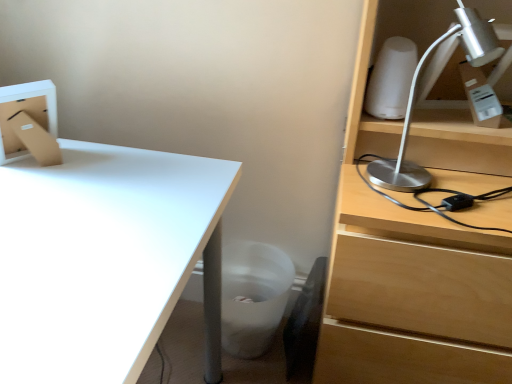
Question: Choose the correct answer: Is white glossy desk at lower left inside white matte trash bin/can at lower center or outside it?

Choices:
 (A) outside
 (B) inside

Answer: (A)

Question: Looking at their shapes, would you say white glossy desk at lower left is wider or thinner than white matte trash bin/can at lower center?

Choices:
 (A) wide
 (B) thin

Answer: (A)

Question: Based on their relative distances, which object is farther from the silver metallic desk lamp at upper right?

Choices:
 (A) white matte trash bin/can at lower center
 (B) white glossy desk at lower left
 (C) black leather swivel chair at lower center

Answer: (C)

Question: Based on their relative distances, which object is farther from the black leather swivel chair at lower center?

Choices:
 (A) white glossy desk at lower left
 (B) white matte trash bin/can at lower center
 (C) silver metallic desk lamp at upper right

Answer: (A)